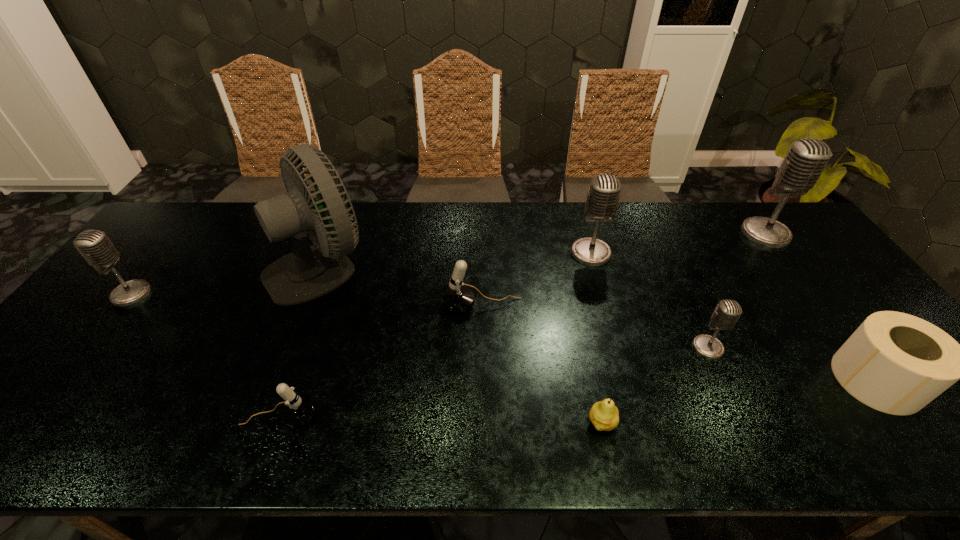
Identify the location of the third gray microphone from left to right. (727, 312).

The image size is (960, 540). What are the coordinates of `toilet tissue` in the screenshot? It's located at (896, 363).

Find the location of `the fifth microphone from right to left`. the fifth microphone from right to left is located at coordinates (298, 410).

Where is `the left white microphone`? The height and width of the screenshot is (540, 960). the left white microphone is located at coordinates [298, 410].

At what (x,y) coordinates should I click in order to perform the action: click on pear. Please return your answer as a coordinate pair (x, y). This screenshot has height=540, width=960. Looking at the image, I should click on (604, 415).

You are a GUI agent. You are given a task and a screenshot of the screen. Output one action in this format:
    pyautogui.click(x=<x>, y=<y>)
    Task: Click on the free space located 0.180m in front of the gray fan to direct airflow
    The height and width of the screenshot is (540, 960).
    Given the screenshot: What is the action you would take?
    pyautogui.click(x=434, y=266)

Identify the location of vacant space located on the left of the tallest microphone. Image resolution: width=960 pixels, height=540 pixels. (639, 233).

Where is `free space located on the right of the third gray microphone from right to left`? The image size is (960, 540). free space located on the right of the third gray microphone from right to left is located at coordinates (642, 253).

This screenshot has height=540, width=960. What are the coordinates of `vacant space located 0.220m on the right of the third biggest gray microphone` in the screenshot? It's located at (227, 294).

I want to click on free space located on the front of the farther white microphone, so click(483, 453).